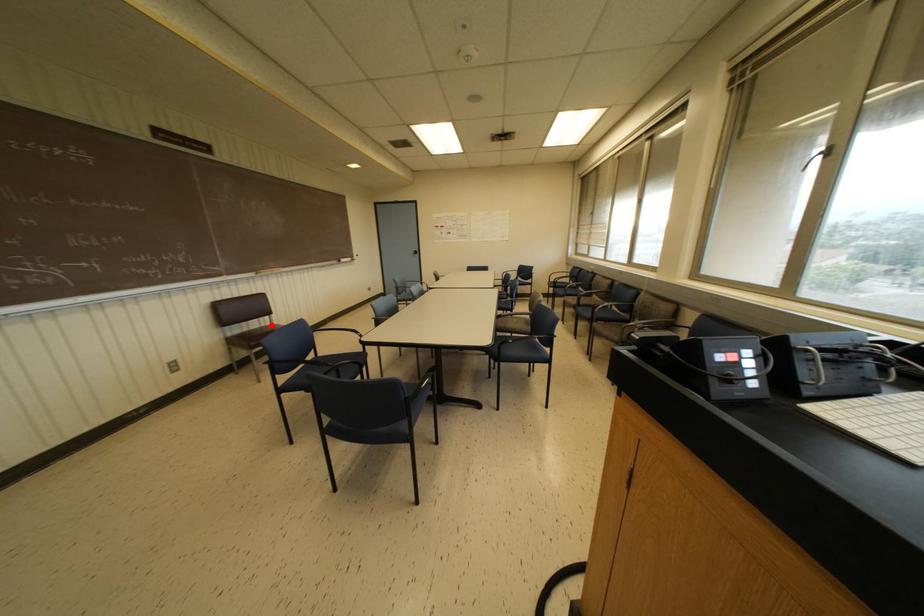
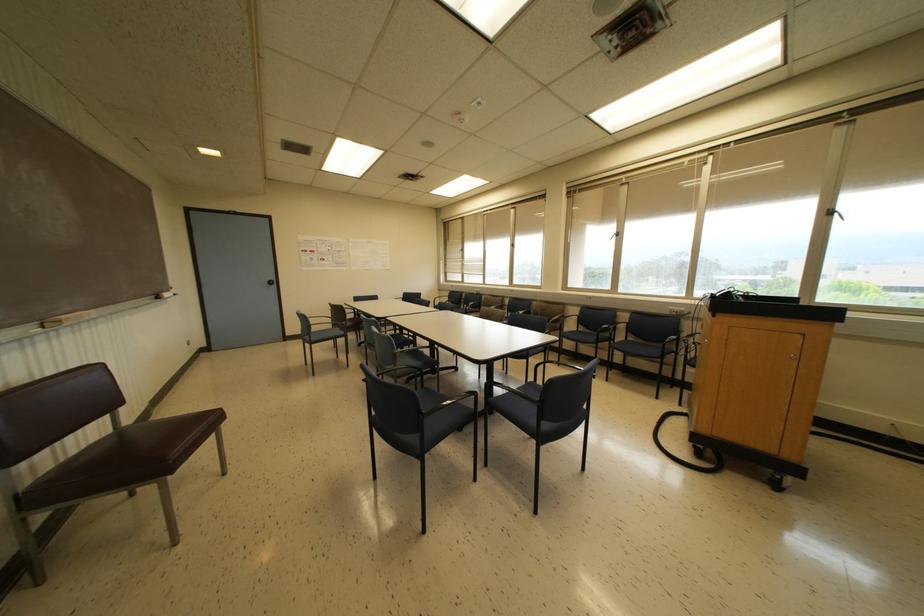
Question: I am providing you with two images of the same scene from different viewpoints. Given a red point in image1, look at the same physical point in image2. Is it:

Choices:
 (A) Closer to the viewpoint
 (B) Farther from the viewpoint

Answer: (A)